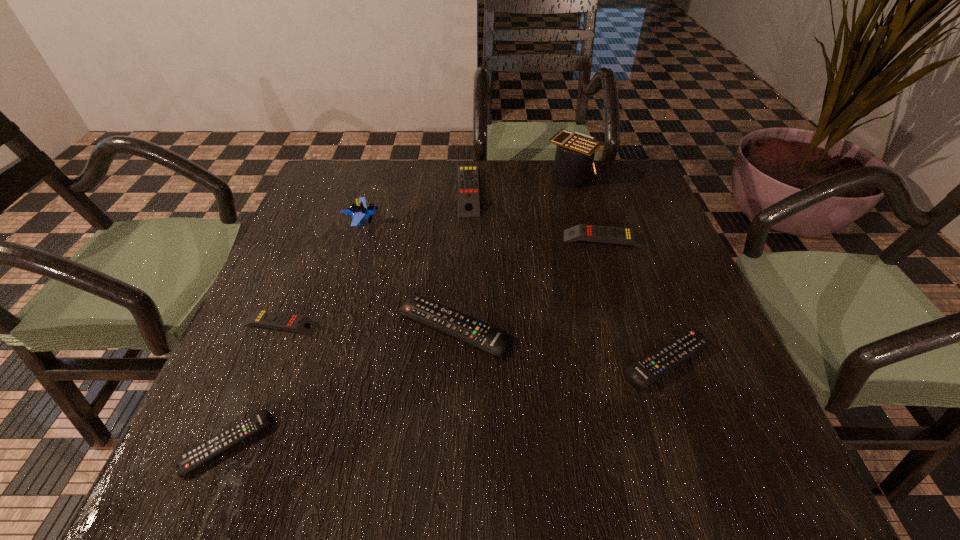
Find the location of `vacant point located between the third tallest object and the second biggest black remote control`. vacant point located between the third tallest object and the second biggest black remote control is located at coordinates (568, 275).

Find the location of a particular element. The image size is (960, 540). free space between the tallest object and the second black remote control from left to right is located at coordinates (512, 252).

The image size is (960, 540). In order to click on free space between the biggest yellow remote control and the rightmost yellow remote control in this screenshot , I will do `click(537, 215)`.

I want to click on vacant area that lies between the biggest black remote control and the smallest yellow remote control, so click(367, 326).

Image resolution: width=960 pixels, height=540 pixels. Identify the location of unoccupied area between the tallest remote control and the nearest black remote control. (348, 317).

Image resolution: width=960 pixels, height=540 pixels. What are the coordinates of `unoccupied area between the biggest yellow remote control and the blue Lego` in the screenshot? It's located at point(415,206).

Where is `object that ranks as the second closest to the seventh shortest object`? The height and width of the screenshot is (540, 960). object that ranks as the second closest to the seventh shortest object is located at coordinates (486, 337).

Choose which object is the sixth nearest neighbor to the rightmost yellow remote control. Please provide its 2D coordinates. Your answer should be formatted as a tuple, i.e. [(x, y)], where the tuple contains the x and y coordinates of a point satisfying the conditions above.

[(263, 318)]

Find the location of a particular element. remote control that is the third closest one to the rightmost black remote control is located at coordinates (468, 184).

Locate which remote control ranks fifth in proximity to the second black remote control from right to left. Please provide its 2D coordinates. Your answer should be formatted as a tuple, i.e. [(x, y)], where the tuple contains the x and y coordinates of a point satisfying the conditions above.

[(468, 184)]